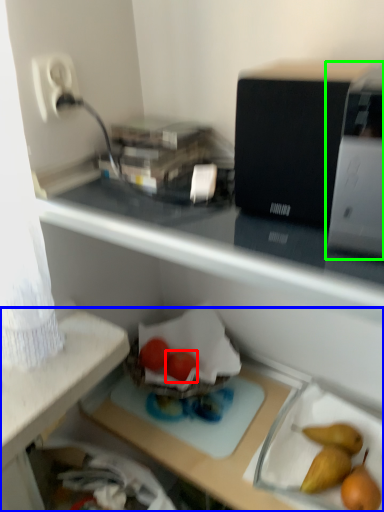
Question: Which object is positioned farthest from green vegetables (highlighted by a red box)? Select from desk (highlighted by a blue box) and appliance (highlighted by a green box).

Choices:
 (A) desk
 (B) appliance

Answer: (B)